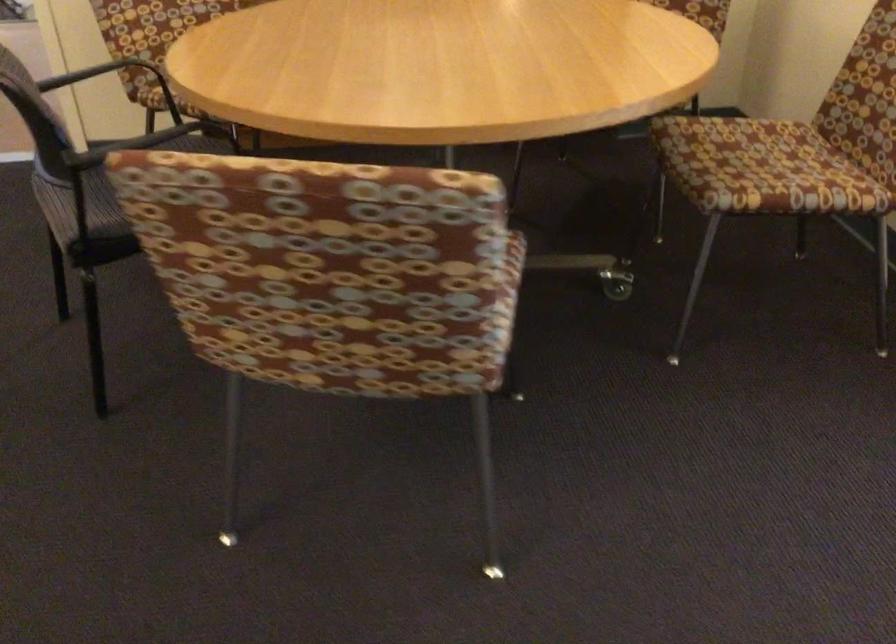
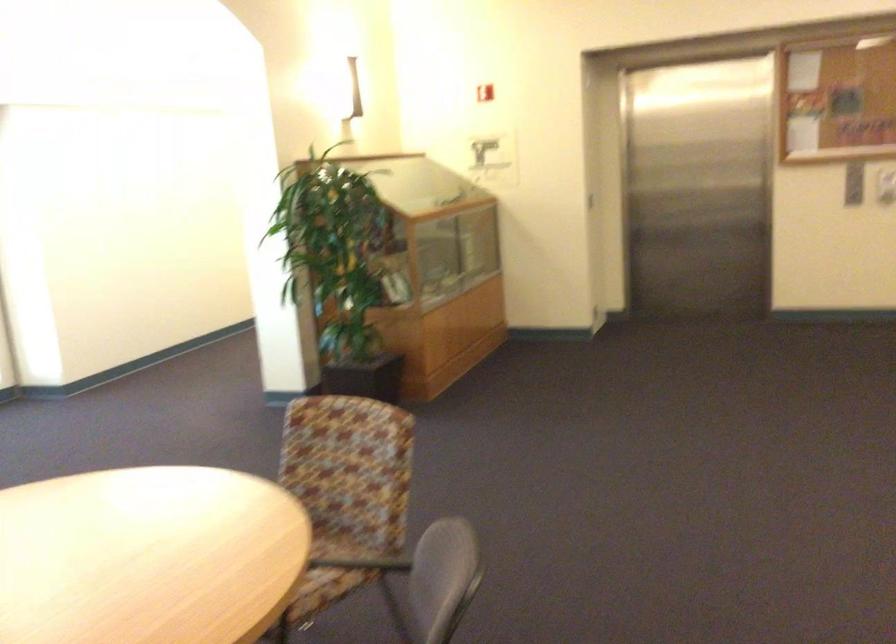
The point at (227,88) is marked in the first image. Where is the corresponding point in the second image?

(288, 535)